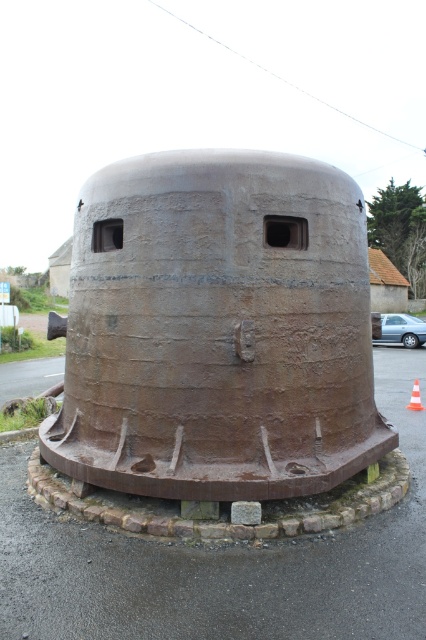
Question: Considering the relative positions of rusty metal water tower at center and orange/reflective traffic cone at center in the image provided, where is rusty metal water tower at center located with respect to orange/reflective traffic cone at center?

Choices:
 (A) below
 (B) above

Answer: (B)

Question: Which point is farther from the camera taking this photo?

Choices:
 (A) (210, 440)
 (B) (414, 381)

Answer: (B)

Question: Which object appears closest to the camera in this image?

Choices:
 (A) orange/reflective traffic cone at center
 (B) silver metallic car at center

Answer: (B)

Question: Does rusty metal water tower at center appear over orange/reflective traffic cone at center?

Choices:
 (A) no
 (B) yes

Answer: (B)

Question: Is rusty metal water tower at center wider than orange/reflective traffic cone at center?

Choices:
 (A) no
 (B) yes

Answer: (B)

Question: Among these objects, which one is farthest from the camera?

Choices:
 (A) orange/reflective traffic cone at center
 (B) silver metallic car at center
 (C) rusty metal water tower at center

Answer: (A)